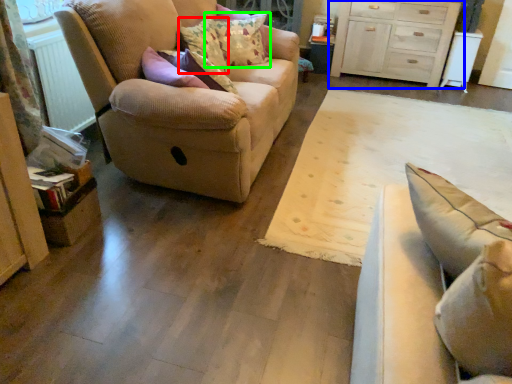
Question: Which is farther away from pillow (highlighted by a red box)? chest of drawers (highlighted by a blue box) or pillow (highlighted by a green box)?

Choices:
 (A) chest of drawers
 (B) pillow

Answer: (A)